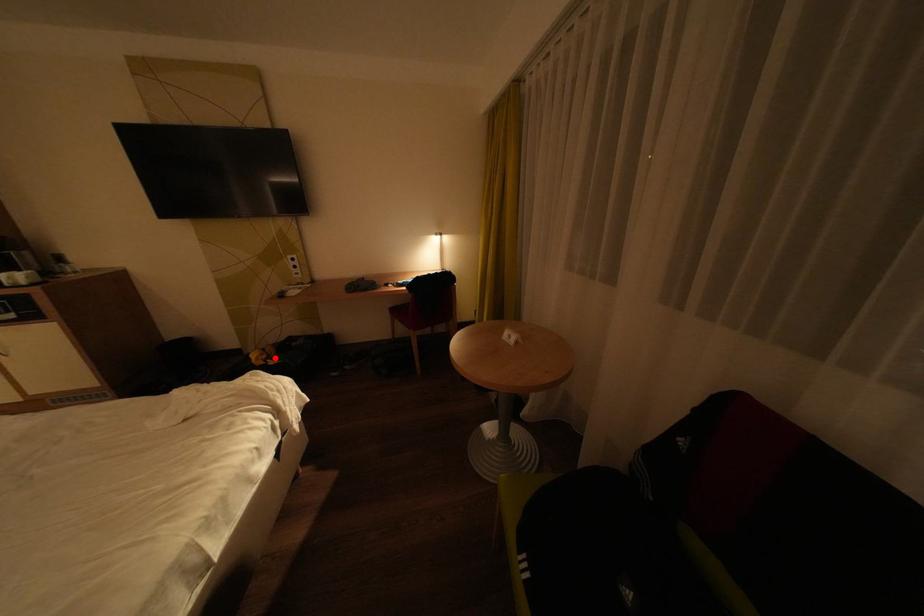
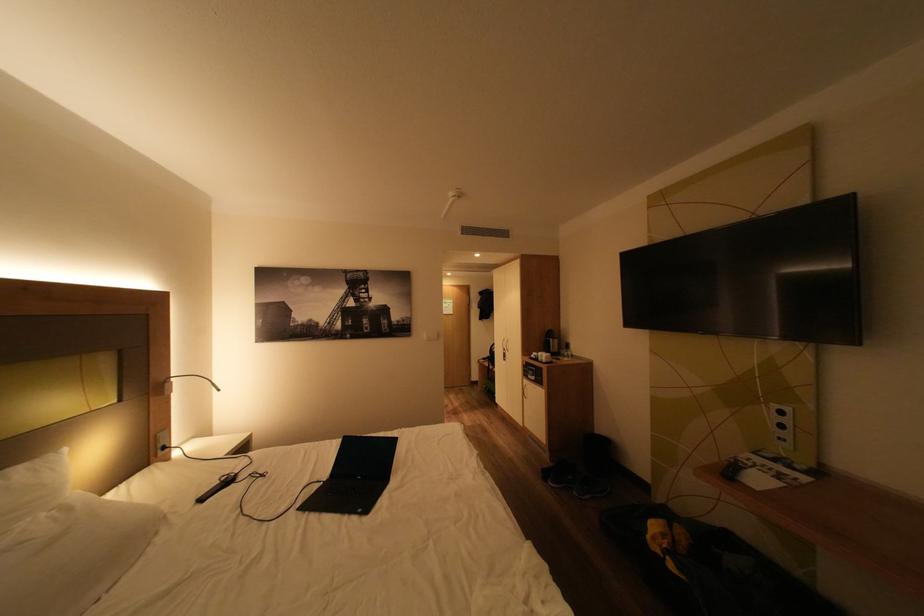
Find the pixel in the second image that matches the highlighted location in the first image.

(675, 546)